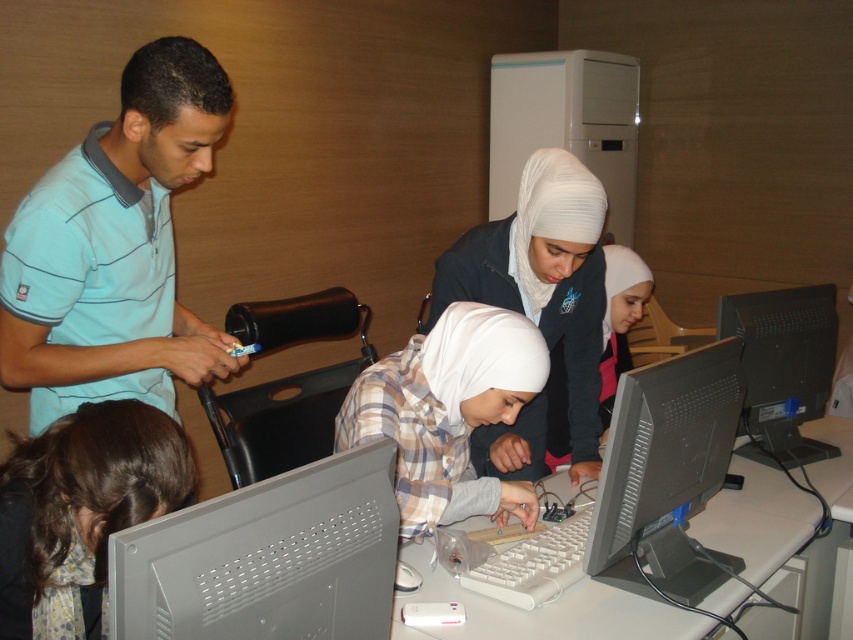
Who is positioned more to the right, plaid fabric shirt at center or black plastic monitor at right?

black plastic monitor at right is more to the right.

Does plaid fabric shirt at center have a smaller size compared to black plastic monitor at right?

Correct, plaid fabric shirt at center occupies less space than black plastic monitor at right.

Is point (409, 422) less distant than point (786, 324)?

Yes, point (409, 422) is in front of point (786, 324).

Image resolution: width=853 pixels, height=640 pixels. In order to click on plaid fabric shirt at center in this screenshot , I will do `click(444, 406)`.

Who is more forward, (164, 54) or (393, 556)?

Point (393, 556) is in front.

Is light blue polo shirt at left thinner than gray matte monitor at lower left?

No.

Locate an element on the screen. This screenshot has height=640, width=853. light blue polo shirt at left is located at coordinates (114, 248).

This screenshot has height=640, width=853. Identify the location of light blue polo shirt at left. (114, 248).

Is white matte hijab at center taller than gray plastic monitor at right?

Yes, white matte hijab at center is taller than gray plastic monitor at right.

Which is behind, point (593, 372) or point (727, 426)?

The point (593, 372) is more distant.

Identify the location of white matte hijab at center. (543, 278).